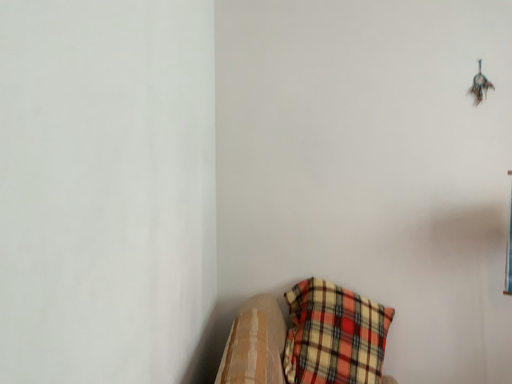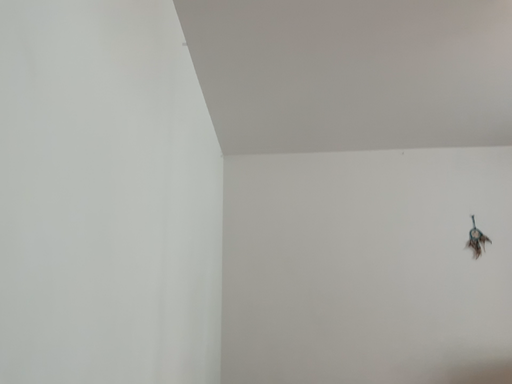
Question: How did the camera likely rotate when shooting the video?

Choices:
 (A) rotated upward
 (B) rotated downward

Answer: (A)